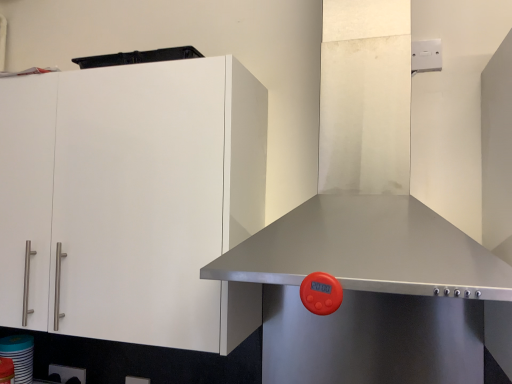
Question: Does stainless steel exhaust hood at center have a larger size compared to white matte cabinet at left?

Choices:
 (A) no
 (B) yes

Answer: (B)

Question: Can you see stainless steel exhaust hood at center touching white matte cabinet at left?

Choices:
 (A) yes
 (B) no

Answer: (B)

Question: Is stainless steel exhaust hood at center not within white matte cabinet at left?

Choices:
 (A) no
 (B) yes

Answer: (B)

Question: From the image's perspective, is stainless steel exhaust hood at center over white matte cabinet at left?

Choices:
 (A) yes
 (B) no

Answer: (A)

Question: Considering the relative sizes of stainless steel exhaust hood at center and white matte cabinet at left in the image provided, is stainless steel exhaust hood at center wider than white matte cabinet at left?

Choices:
 (A) no
 (B) yes

Answer: (B)

Question: Based on their sizes in the image, would you say white matte cabinet at left is bigger or smaller than stainless steel exhaust hood at center?

Choices:
 (A) big
 (B) small

Answer: (B)

Question: Considering their positions, is white matte cabinet at left located in front of or behind stainless steel exhaust hood at center?

Choices:
 (A) behind
 (B) front

Answer: (A)

Question: From a real-world perspective, is white matte cabinet at left positioned above or below stainless steel exhaust hood at center?

Choices:
 (A) above
 (B) below

Answer: (B)

Question: Considering the positions of white matte cabinet at left and stainless steel exhaust hood at center in the image, is white matte cabinet at left wider or thinner than stainless steel exhaust hood at center?

Choices:
 (A) thin
 (B) wide

Answer: (A)

Question: Which is correct: white glossy cup at lower left is inside stainless steel exhaust hood at center, or outside of it?

Choices:
 (A) outside
 (B) inside

Answer: (A)

Question: Considering the positions of white glossy cup at lower left and stainless steel exhaust hood at center in the image, is white glossy cup at lower left wider or thinner than stainless steel exhaust hood at center?

Choices:
 (A) thin
 (B) wide

Answer: (A)

Question: Looking at the image, does white glossy cup at lower left seem bigger or smaller compared to stainless steel exhaust hood at center?

Choices:
 (A) big
 (B) small

Answer: (B)

Question: From the image's perspective, is white glossy cup at lower left above or below stainless steel exhaust hood at center?

Choices:
 (A) below
 (B) above

Answer: (A)

Question: Relative to white glossy cup at lower left, is stainless steel exhaust hood at center in front or behind?

Choices:
 (A) behind
 (B) front

Answer: (B)

Question: Looking at their shapes, would you say stainless steel exhaust hood at center is wider or thinner than white glossy cup at lower left?

Choices:
 (A) thin
 (B) wide

Answer: (B)